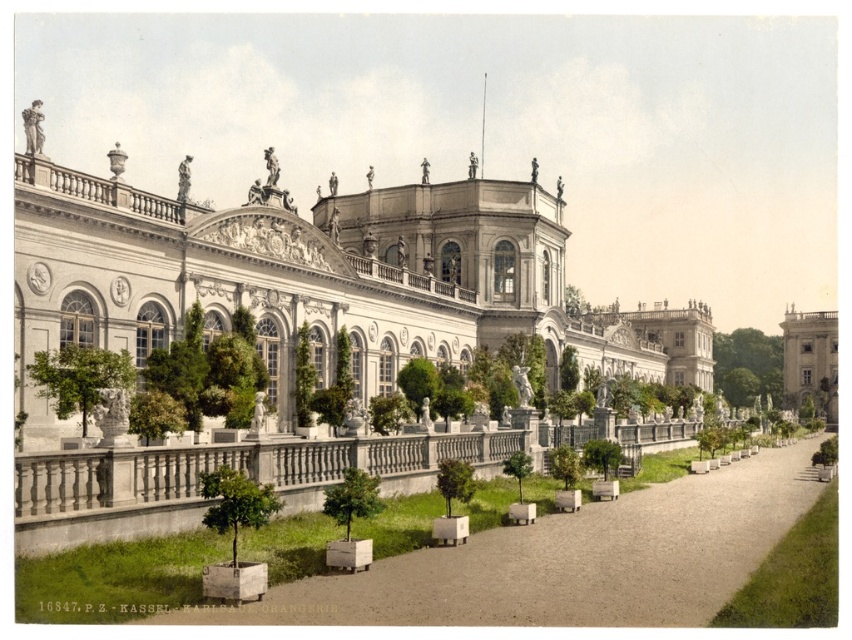
Looking at this image, you are standing at the entrance of the white stone palace at center. If you walk straight ahead, will you exit the building through the main entrance or enter it?

Since you are standing at the entrance of the white stone palace at center, walking straight ahead would mean exiting the building through the main entrance.